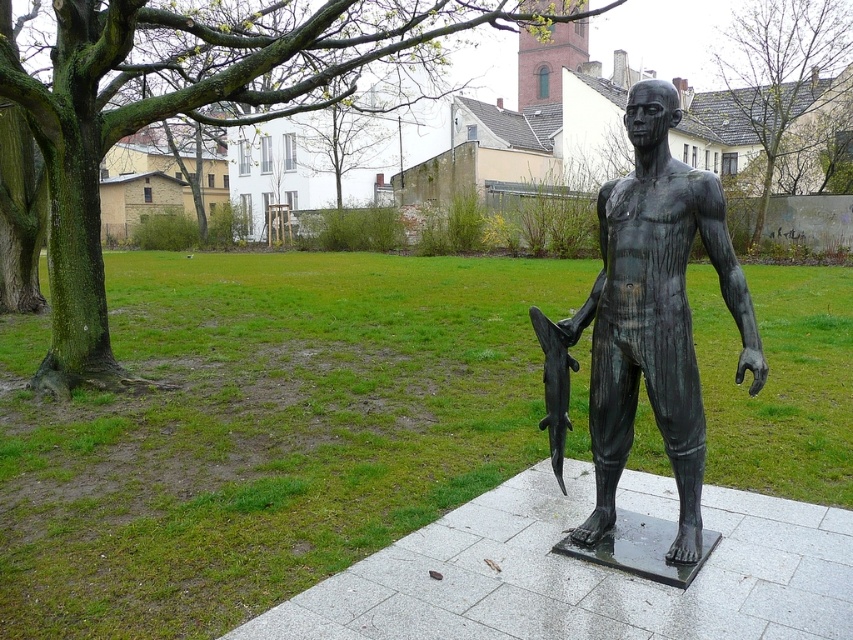
Consider the image. Is bronze statue at center further to camera compared to polished bronze shark at lower right?

No.

Looking at this image, is bronze statue at center positioned before polished bronze shark at lower right?

Yes, bronze statue at center is closer to the viewer.

Between point (751, 316) and point (550, 387), which one is positioned behind?

Positioned behind is point (550, 387).

Identify the location of bronze statue at center. (647, 320).